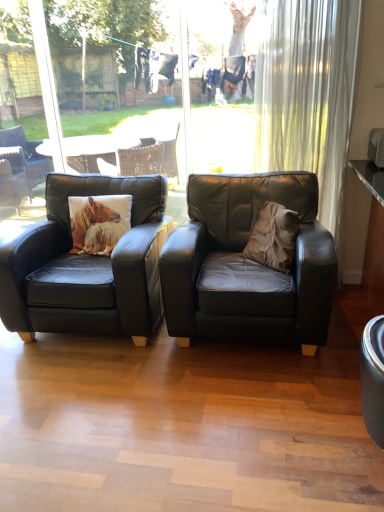
Locate an element on the screen. The height and width of the screenshot is (512, 384). free space in front of matte black armchair at center, the first chair viewed from the right is located at coordinates (237, 417).